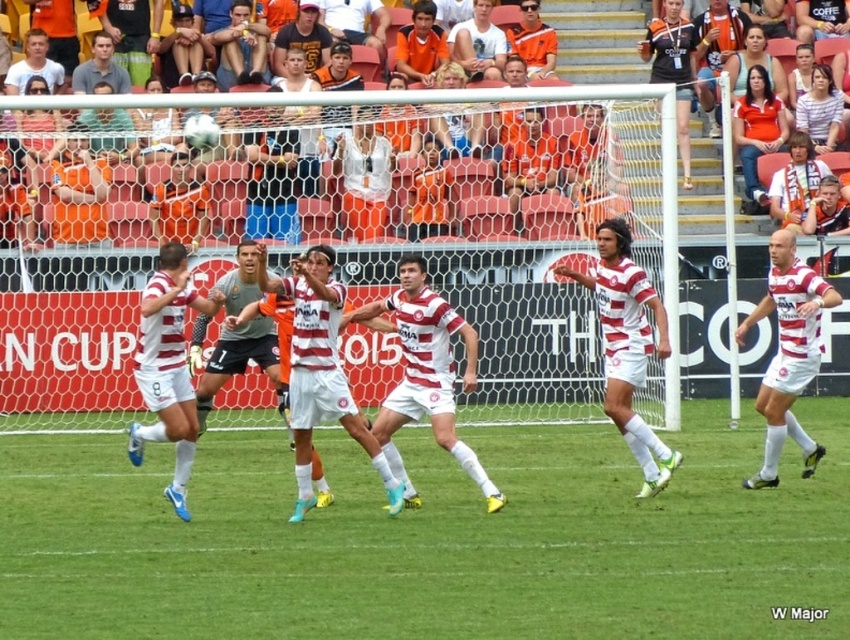
Where is `green grass at center`? This screenshot has width=850, height=640. green grass at center is located at coordinates (429, 540).

Is point (95, 481) closer to viewer compared to point (239, 288)?

Yes, it is in front of point (239, 288).

You are a GUI agent. You are given a task and a screenshot of the screen. Output one action in this format:
    pyautogui.click(x=<x>, y=<y>)
    Task: Click on the green grass at center
    This screenshot has height=640, width=850.
    Given the screenshot: What is the action you would take?
    pyautogui.click(x=429, y=540)

This screenshot has height=640, width=850. What do you see at coordinates (788, 353) in the screenshot? I see `white striped jersey at center` at bounding box center [788, 353].

Between white striped jersey at center and matte black jersey at center, which one appears on the right side from the viewer's perspective?

white striped jersey at center

I want to click on white striped jersey at center, so pos(788,353).

Does white striped jersey at center come in front of white matte soccer player at center?

That is False.

What do you see at coordinates (788, 353) in the screenshot? The width and height of the screenshot is (850, 640). I see `white striped jersey at center` at bounding box center [788, 353].

Locate an element on the screen. white striped jersey at center is located at coordinates (788, 353).